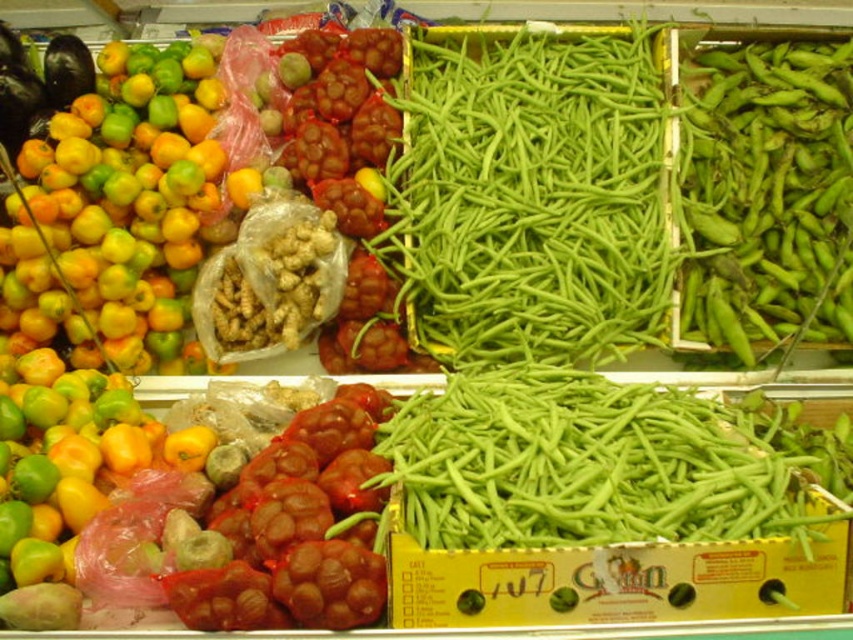
You are a customer at the market stall and want to buy the larger of the two green items. The vendor points to the green smooth beans at center and the green matte pod at upper right. Which one should you choose?

The green smooth beans at center is bigger than the green matte pod at upper right, so you should choose the green smooth beans at center.

You are a customer at the market stall and want to locate the green smooth beans at center. According to the coordinates provided, where exactly would you find them?

The green smooth beans at center are located at coordinates point (529, 195).